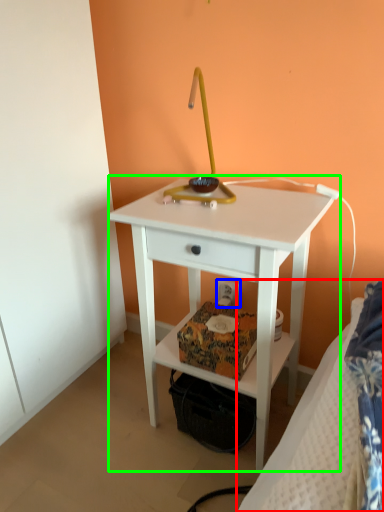
Question: Estimate the real-world distances between objects in this image. Which object is closer to bed (highlighted by a red box), electric outlet (highlighted by a blue box) or nightstand (highlighted by a green box)?

Choices:
 (A) electric outlet
 (B) nightstand

Answer: (B)